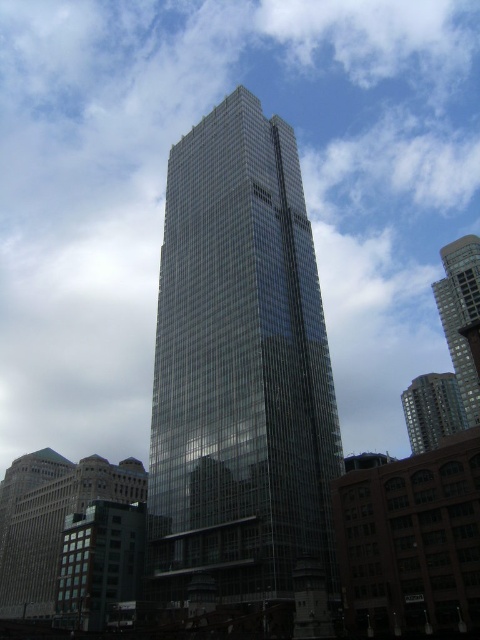
You are a city planner assessing the distance between two glassy buildings in the scene. Given that the minimum required distance between skyscrapers in this area is 20 meters for safety regulations, can the glassy skyscraper at center and the glassy reflective building at right comply with the regulation?

The glassy skyscraper at center is 25.03 meters from the glassy reflective building at right, which exceeds the minimum required distance of 20 meters. Therefore, they comply with the safety regulations.

Based on the photo, you are an architect analyzing the urban skyline. You observe the transparent glass skyscraper at center and the glassy skyscraper at center. Which one is positioned lower in the image?

The transparent glass skyscraper at center is located below the glassy skyscraper at center, so it is positioned lower in the image.

You are standing on the street looking at the two buildings in the scene. Which building would appear larger to you, the transparent glass skyscraper at center or the glassy reflective building at right?

The transparent glass skyscraper at center appears larger because it is closer to the viewer than the glassy reflective building at right.